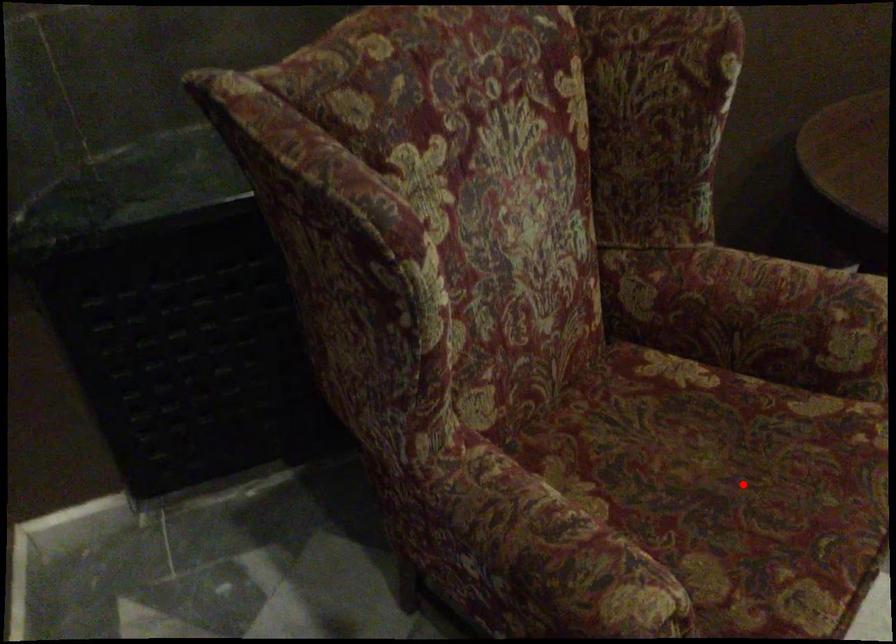
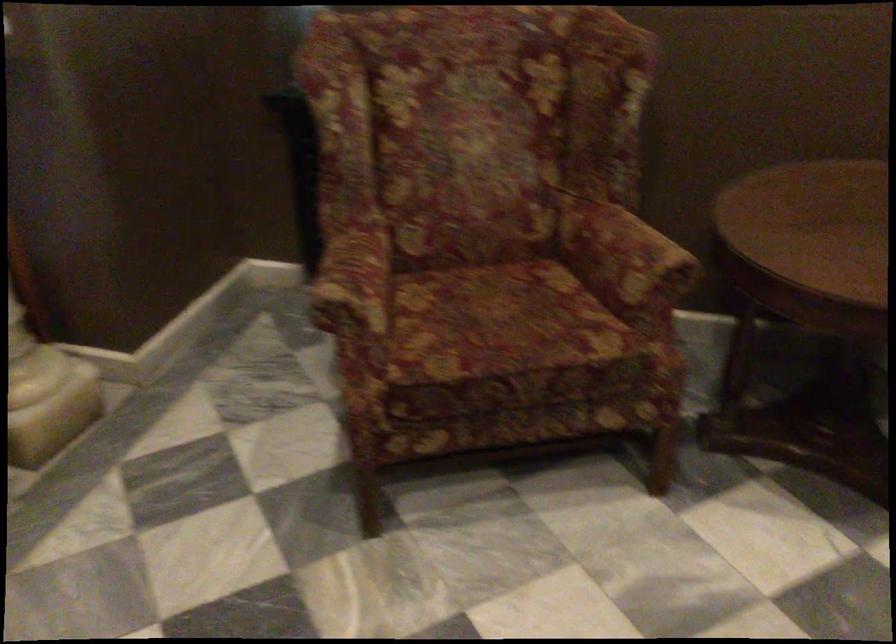
Where in the second image is the point corresponding to the highlighted location from the first image?

(501, 323)